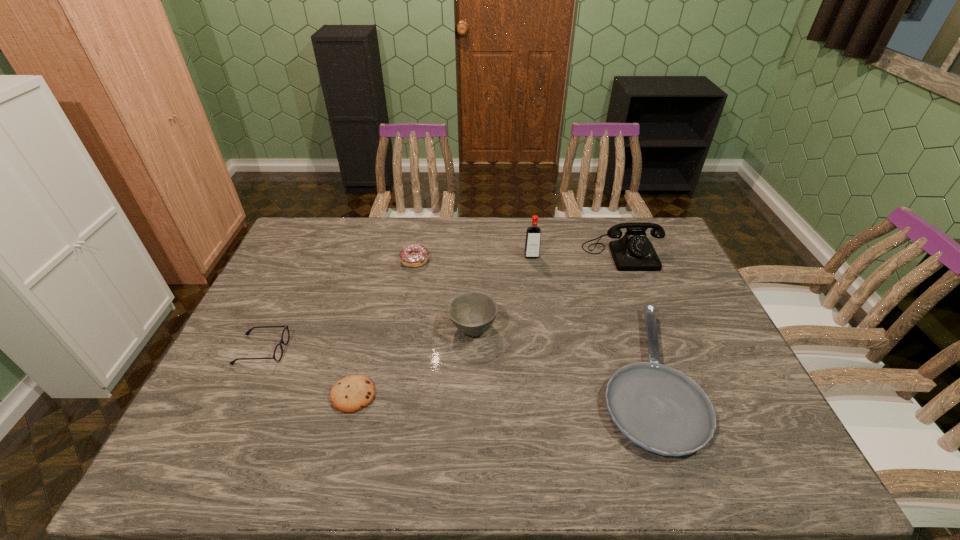
Image resolution: width=960 pixels, height=540 pixels. What are the coordinates of `object that is at the left edge` in the screenshot? It's located at (278, 352).

Identify the location of telephone positioned at the right edge. (633, 252).

This screenshot has width=960, height=540. Find the location of `frying pan positioned at the right edge`. frying pan positioned at the right edge is located at coordinates (659, 408).

At what (x,y) coordinates should I click in order to perform the action: click on object situated at the far right corner. Please return your answer as a coordinate pair (x, y). Looking at the image, I should click on (633, 252).

You are a GUI agent. You are given a task and a screenshot of the screen. Output one action in this format:
    pyautogui.click(x=<x>, y=<y>)
    Task: Click on the object that is at the near right corner
    
    Given the screenshot: What is the action you would take?
    pyautogui.click(x=659, y=408)

Find the location of a particular element. Image resolution: width=960 pixels, height=540 pixels. vacant space at the far edge is located at coordinates [373, 217].

In order to click on free region at the near edge of the desktop in this screenshot , I will do `click(597, 460)`.

At what (x,y) coordinates should I click in order to perform the action: click on vacant region at the left edge. Please return your answer as a coordinate pair (x, y). Looking at the image, I should click on pos(258,365).

I want to click on vacant region at the right edge, so click(701, 312).

Where is `free space at the far left corner of the desktop`? The image size is (960, 540). free space at the far left corner of the desktop is located at coordinates (324, 218).